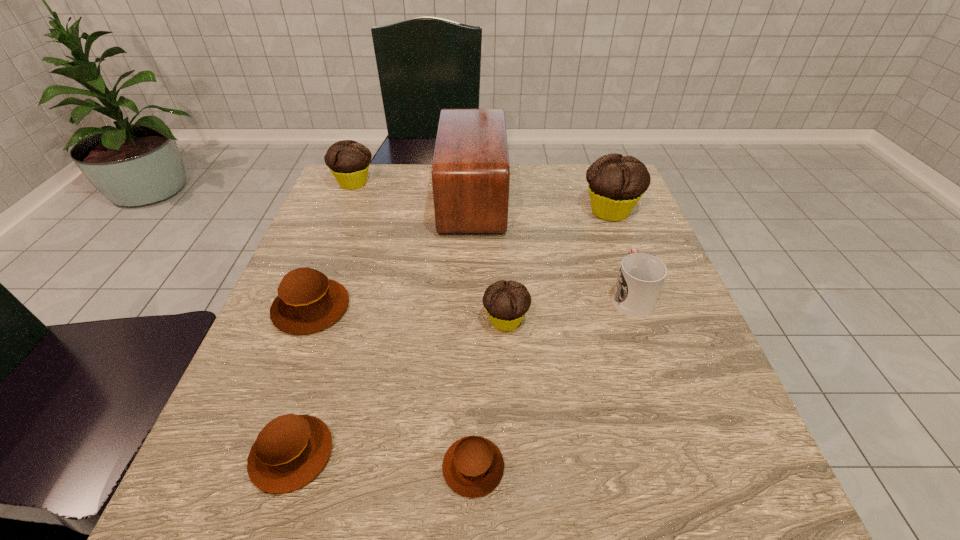
Where is `chocolate muffin that can be found as the closest to the second biggest chocolate muffin`? This screenshot has height=540, width=960. chocolate muffin that can be found as the closest to the second biggest chocolate muffin is located at coordinates (506, 302).

Find the location of a particular element. The width and height of the screenshot is (960, 540). the closest brown muffin to the seventh tallest object is located at coordinates (307, 302).

The image size is (960, 540). Identify the location of brown muffin that is the second closest one to the seventh tallest object. (473, 466).

Find the location of a particular element. This screenshot has height=540, width=960. vacant region that satisfies the following two spatial constraints: 1. on the front panel of the tallest object; 2. on the front side of the second shortest object is located at coordinates (467, 454).

Find the location of a particular element. The image size is (960, 540). vacant area in the image that satisfies the following two spatial constraints: 1. on the front side of the biggest brown muffin; 2. on the right side of the nearest chocolate muffin is located at coordinates (306, 321).

Locate an element on the screen. vacant space that satisfies the following two spatial constraints: 1. on the front side of the farthest brown muffin; 2. on the right side of the smallest brown muffin is located at coordinates click(251, 467).